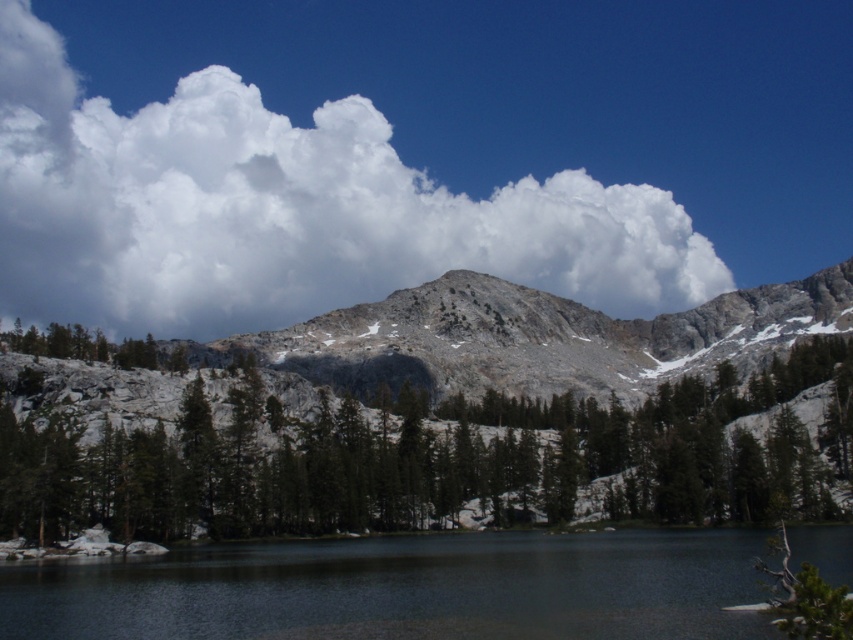
You are a hiker standing at the edge of the smooth dark water at lower center. You want to reach the green matte tree at center. Which direction should you move to get closer to the tree?

The green matte tree at center is located above the smooth dark water at lower center, so you should move upward to get closer to the tree.

You are standing at the edge of the smooth dark water at lower center and want to climb up to the rocky gray mountain at center. Based on the scene description, which object is taller and would require more effort to ascend?

The rocky gray mountain at center is taller than the smooth dark water at lower center, so it would require more effort to ascend.

Looking at this image, you are standing at the edge of the smooth dark water at lower center and want to take a photo of the rocky gray mountain at center. Which object should you focus on first to ensure both are in the frame?

You should focus on the rocky gray mountain at center first because it occupies more space in the image than the smooth dark water at lower center, ensuring it is properly framed.